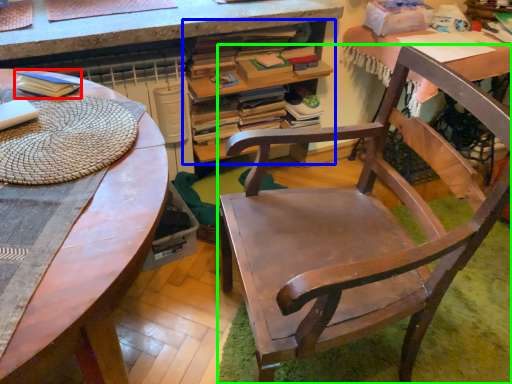
Question: Which object is the farthest from paperback book (highlighted by a red box)? Choose among these: desk with bookshelf (highlighted by a blue box) or chair (highlighted by a green box).

Choices:
 (A) desk with bookshelf
 (B) chair

Answer: (B)